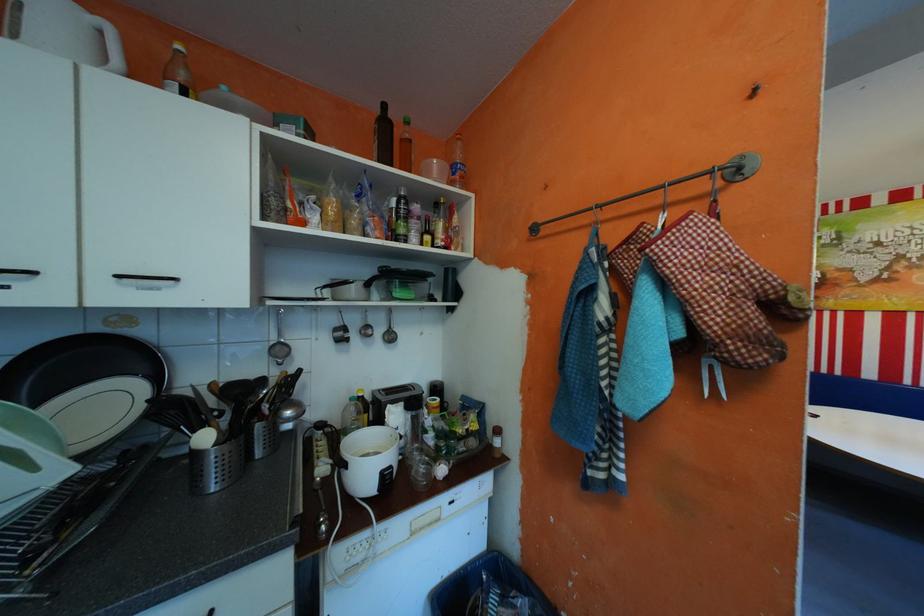
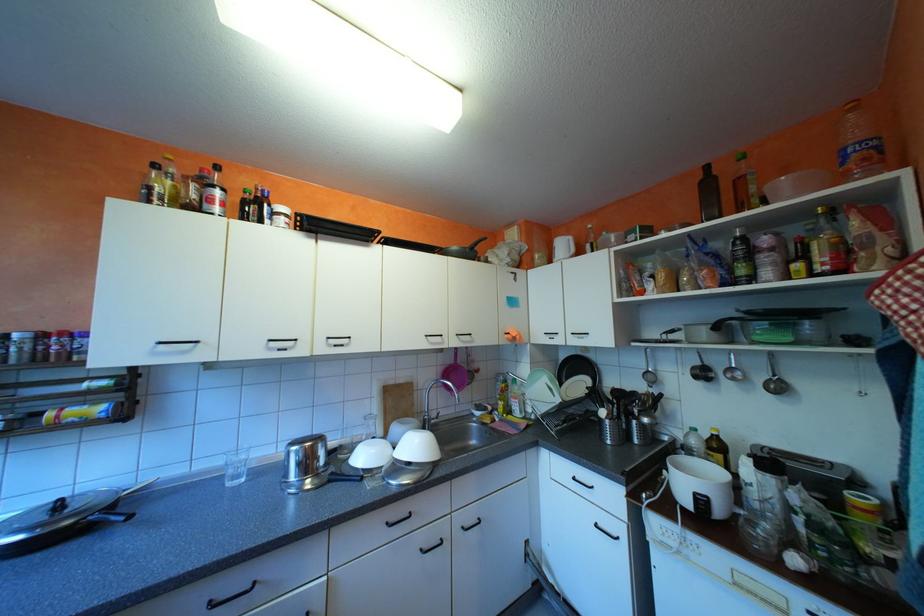
Find the pixel in the second image that matches (x=390, y=111) in the first image.

(711, 176)